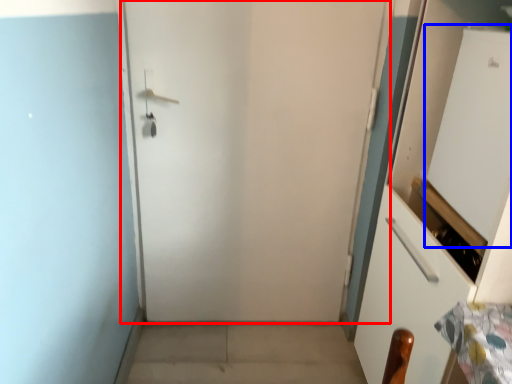
Question: Which point is closer to the camera, door (highlighted by a red box) or screen door (highlighted by a blue box)?

Choices:
 (A) door
 (B) screen door

Answer: (B)